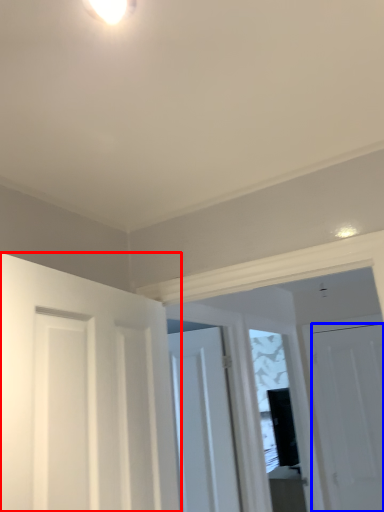
Question: Among these objects, which one is farthest to the camera, door (highlighted by a red box) or door (highlighted by a blue box)?

Choices:
 (A) door
 (B) door

Answer: (B)